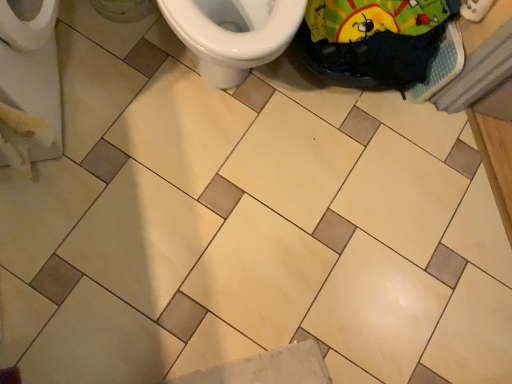
Question: From a real-world perspective, is green fabric bag at upper right on white glossy toilet at upper center?

Choices:
 (A) yes
 (B) no

Answer: (B)

Question: Would you say green fabric bag at upper right contains white glossy toilet at upper center?

Choices:
 (A) yes
 (B) no

Answer: (B)

Question: Is white glossy toilet at upper center at the back of green fabric bag at upper right?

Choices:
 (A) no
 (B) yes

Answer: (A)

Question: Does green fabric bag at upper right have a greater width compared to white glossy toilet at upper center?

Choices:
 (A) yes
 (B) no

Answer: (B)

Question: Would you consider green fabric bag at upper right to be distant from white glossy toilet at upper center?

Choices:
 (A) yes
 (B) no

Answer: (B)

Question: From a real-world perspective, is green fabric bag at upper right physically below white glossy toilet at upper center?

Choices:
 (A) no
 (B) yes

Answer: (B)

Question: Does white glossy toilet at upper center come in front of green fabric bag at upper right?

Choices:
 (A) no
 (B) yes

Answer: (B)

Question: From a real-world perspective, is white glossy toilet at upper center on green fabric bag at upper right?

Choices:
 (A) no
 (B) yes

Answer: (B)

Question: From a real-world perspective, is white glossy toilet at upper center beneath green fabric bag at upper right?

Choices:
 (A) no
 (B) yes

Answer: (A)

Question: From the image's perspective, would you say white glossy toilet at upper center is shown under green fabric bag at upper right?

Choices:
 (A) yes
 (B) no

Answer: (B)

Question: Is white glossy toilet at upper center directly adjacent to green fabric bag at upper right?

Choices:
 (A) yes
 (B) no

Answer: (B)

Question: Is white glossy toilet at upper center not within green fabric bag at upper right?

Choices:
 (A) yes
 (B) no

Answer: (A)

Question: Is point (276, 14) positioned closer to the camera than point (324, 56)?

Choices:
 (A) farther
 (B) closer

Answer: (B)